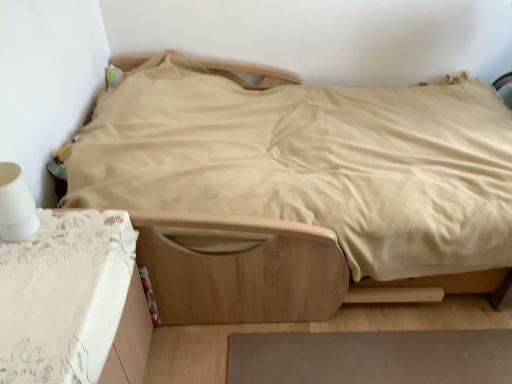
I want to click on vacant area on top of brown matte rug at lower center (from a real-world perspective), so click(x=392, y=361).